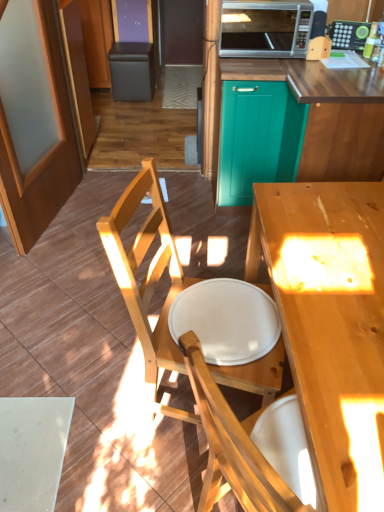
Where is `teal wood cabinet at upper center`? The height and width of the screenshot is (512, 384). teal wood cabinet at upper center is located at coordinates (310, 116).

Describe the element at coordinates (265, 29) in the screenshot. I see `silver metallic microwave at upper center` at that location.

You are a GUI agent. You are given a task and a screenshot of the screen. Output one action in this format:
    pyautogui.click(x=<x>, y=<y>)
    Task: Click on the teal glossy cabinet at center, the second screen door viewed from the left
    The width and height of the screenshot is (384, 512).
    Given the screenshot: What is the action you would take?
    pyautogui.click(x=249, y=137)

Find the location of `light wood chair at center`. light wood chair at center is located at coordinates (148, 276).

What is the approximate width of light wood chair at center?

light wood chair at center is 20.23 inches wide.

This screenshot has height=512, width=384. Find the location of `teal wood cabinet at upper center`. teal wood cabinet at upper center is located at coordinates (310, 116).

In the image, is white matte plate at center on the left side or the right side of silver metallic microwave at upper center?

In the image, white matte plate at center appears on the left side of silver metallic microwave at upper center.

Is white matte plate at center oriented away from silver metallic microwave at upper center?

No, silver metallic microwave at upper center is not at the back of white matte plate at center.

From the image's perspective, which one is positioned higher, white matte plate at center or silver metallic microwave at upper center?

silver metallic microwave at upper center appears higher in the image.

Is white matte plate at center in contact with silver metallic microwave at upper center?

No.

What's the angular difference between light wood chair at center and matte black bar stool at upper left's facing directions?

The angular difference between light wood chair at center and matte black bar stool at upper left is 77.9 degrees.

Is light wood chair at center not close to matte black bar stool at upper left?

Indeed, light wood chair at center is not near matte black bar stool at upper left.

Does light wood chair at center have a greater width compared to matte black bar stool at upper left?

Yes.

Is light wood chair at center oriented away from matte black bar stool at upper left?

light wood chair at center is not turned away from matte black bar stool at upper left.

Measure the distance between green plastic microwave at upper center and teal wood cabinet at upper center.

green plastic microwave at upper center and teal wood cabinet at upper center are 21.81 inches apart.

Is green plastic microwave at upper center positioned far away from teal wood cabinet at upper center?

No, green plastic microwave at upper center is not far away from teal wood cabinet at upper center.

Considering the points (349, 38) and (302, 87), which point is behind, point (349, 38) or point (302, 87)?

Positioned behind is point (349, 38).

Find the location of a particular element. cabinetry in front of the green plastic microwave at upper center is located at coordinates (310, 116).

Is white matte plate at center looking in the opposite direction of wooden screen door at left, the first screen door positioned from the left?

white matte plate at center does not have its back to wooden screen door at left, the first screen door positioned from the left.

Locate an element on the screen. round table below the wooden screen door at left, the first screen door positioned from the left (from a real-world perspective) is located at coordinates (226, 320).

Is white matte plate at center taller than wooden screen door at left, the first screen door positioned from the left?

Incorrect, the height of white matte plate at center is not larger of that of wooden screen door at left, the first screen door positioned from the left.

Consider the image. Between white matte plate at center and wooden screen door at left, placed as the second screen door when sorted from right to left, which one appears on the left side from the viewer's perspective?

wooden screen door at left, placed as the second screen door when sorted from right to left, is more to the left.

Is green plastic microwave at upper center wider or thinner than white matte plate at center?

Clearly, green plastic microwave at upper center has less width compared to white matte plate at center.

Which is behind, point (335, 41) or point (190, 329)?

Positioned behind is point (335, 41).

Is green plastic microwave at upper center placed right next to white matte plate at center?

No.

Which object is closer to the camera, green plastic microwave at upper center or white matte plate at center?

white matte plate at center is more forward.

Which point is more forward, [56,19] or [349,49]?

The point [349,49] is closer.

From the green plastic microwave at upper center, count the 2nd screen door to the left and point to it. Please provide its 2D coordinates.

[(34, 121)]

Is green plastic microwave at upper center at the back of wooden screen door at left, the first screen door positioned from the left?

No, wooden screen door at left, the first screen door positioned from the left,'s orientation is not away from green plastic microwave at upper center.

Considering the relative positions of wooden screen door at left, the first screen door positioned from the left, and green plastic microwave at upper center in the image provided, is wooden screen door at left, the first screen door positioned from the left, to the right of green plastic microwave at upper center from the viewer's perspective?

In fact, wooden screen door at left, the first screen door positioned from the left, is to the left of green plastic microwave at upper center.

Considering the relative sizes of green plastic microwave at upper center and silver metallic microwave at upper center in the image provided, is green plastic microwave at upper center taller than silver metallic microwave at upper center?

In fact, green plastic microwave at upper center may be shorter than silver metallic microwave at upper center.

Does green plastic microwave at upper center turn towards silver metallic microwave at upper center?

No, green plastic microwave at upper center is not turned towards silver metallic microwave at upper center.

Between green plastic microwave at upper center and silver metallic microwave at upper center, which one appears on the left side from the viewer's perspective?

silver metallic microwave at upper center is more to the left.

Considering the relative sizes of green plastic microwave at upper center and silver metallic microwave at upper center in the image provided, is green plastic microwave at upper center wider than silver metallic microwave at upper center?

In fact, green plastic microwave at upper center might be narrower than silver metallic microwave at upper center.

Find the location of a particular element. The height and width of the screenshot is (512, 384). microwave oven above the white matte plate at center (from a real-world perspective) is located at coordinates (265, 29).

The width and height of the screenshot is (384, 512). Find the location of `bar stool behind the light wood chair at center`. bar stool behind the light wood chair at center is located at coordinates (132, 71).

Consider the image. When comparing their distances from teal glossy cabinet at center, which appears as the first screen door when viewed from the right, does teal wood cabinet at upper center or wooden screen door at left, placed as the second screen door when sorted from right to left, seem further?

wooden screen door at left, placed as the second screen door when sorted from right to left, is further to teal glossy cabinet at center, which appears as the first screen door when viewed from the right.

When comparing their distances from matte black bar stool at upper left, does light wood desk at center or white matte plate at center seem further?

Based on the image, light wood desk at center appears to be further to matte black bar stool at upper left.

Based on the photo, from the image, which object appears to be nearer to wooden screen door at left, the first screen door positioned from the left, green plastic microwave at upper center or light wood chair at center?

light wood chair at center is positioned closer to the anchor wooden screen door at left, the first screen door positioned from the left.

From the image, which object appears to be nearer to teal glossy cabinet at center, the second screen door viewed from the left, white matte plate at center or teal wood cabinet at upper center?

The object closer to teal glossy cabinet at center, the second screen door viewed from the left, is teal wood cabinet at upper center.

Which object lies nearer to the anchor point light wood chair at center, wooden screen door at left, the first screen door positioned from the left, or matte black bar stool at upper left?

wooden screen door at left, the first screen door positioned from the left, is positioned closer to the anchor light wood chair at center.

Based on the photo, which object lies nearer to the anchor point wooden screen door at left, placed as the second screen door when sorted from right to left, teal glossy cabinet at center, the second screen door viewed from the left, or green plastic microwave at upper center?

teal glossy cabinet at center, the second screen door viewed from the left, lies closer to wooden screen door at left, placed as the second screen door when sorted from right to left, than the other object.

When comparing their distances from silver metallic microwave at upper center, does teal wood cabinet at upper center or wooden screen door at left, the first screen door positioned from the left, seem further?

wooden screen door at left, the first screen door positioned from the left.

Looking at the image, which one is located closer to silver metallic microwave at upper center, teal wood cabinet at upper center or white matte plate at center?

teal wood cabinet at upper center.

Where is `microwave oven between green plastic microwave at upper center and light wood desk at center vertically`? microwave oven between green plastic microwave at upper center and light wood desk at center vertically is located at coordinates (265, 29).

Image resolution: width=384 pixels, height=512 pixels. I want to click on screen door situated between wooden screen door at left, the first screen door positioned from the left, and silver metallic microwave at upper center from left to right, so click(x=249, y=137).

Image resolution: width=384 pixels, height=512 pixels. Find the location of `round table situated between wooden screen door at left, placed as the second screen door when sorted from right to left, and green plastic microwave at upper center from left to right`. round table situated between wooden screen door at left, placed as the second screen door when sorted from right to left, and green plastic microwave at upper center from left to right is located at coordinates (226, 320).

The height and width of the screenshot is (512, 384). What are the coordinates of `microwave oven positioned between white matte plate at center and matte black bar stool at upper left from near to far` in the screenshot? It's located at (265, 29).